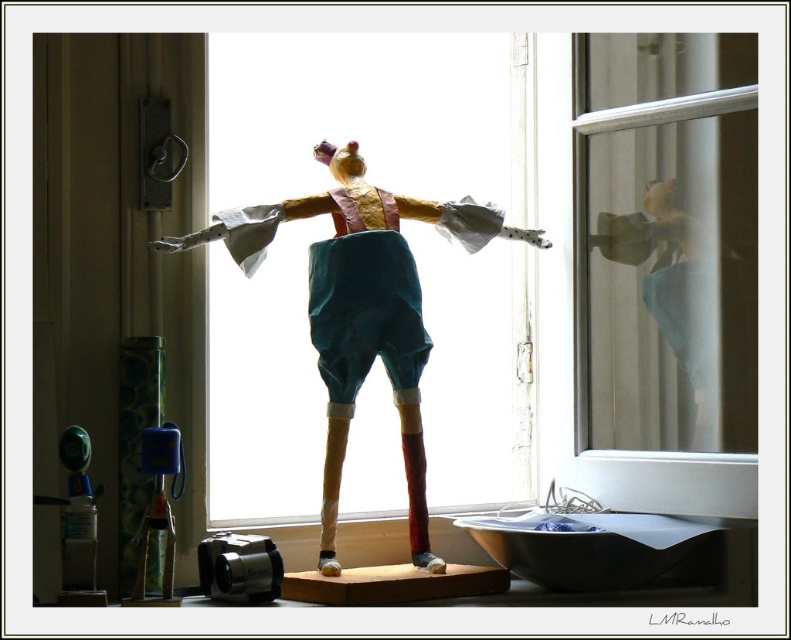
Question: Among these points, which one is farthest from the camera?

Choices:
 (A) (168, 588)
 (B) (438, 476)

Answer: (B)

Question: Does transparent glass window at center appear under blue plastic toy at left?

Choices:
 (A) yes
 (B) no

Answer: (B)

Question: Does transparent glass window at center have a smaller size compared to translucent plastic bottle at lower left?

Choices:
 (A) no
 (B) yes

Answer: (A)

Question: Which point is closer to the camera?

Choices:
 (A) (171, 493)
 (B) (513, 429)

Answer: (A)

Question: Estimate the real-world distances between objects in this image. Which object is closer to the transparent glass window at center?

Choices:
 (A) translucent plastic bottle at lower left
 (B) blue plastic toy at left

Answer: (B)

Question: Is transparent glass window at center to the left of blue plastic toy at left from the viewer's perspective?

Choices:
 (A) no
 (B) yes

Answer: (A)